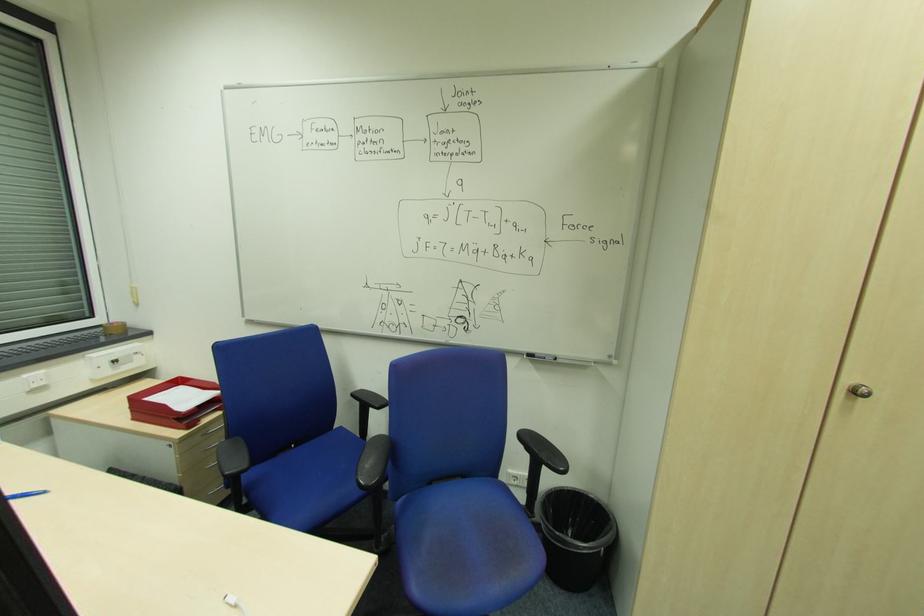
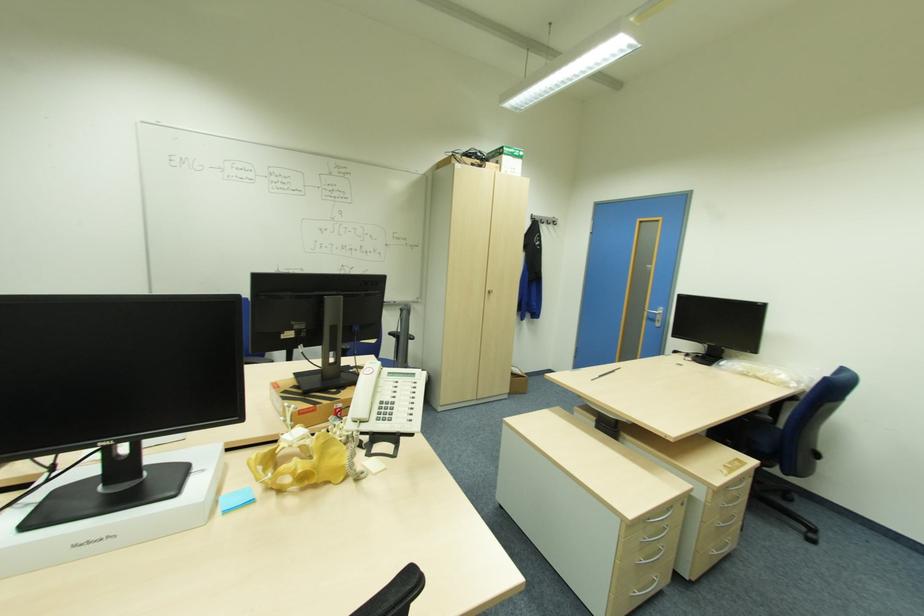
Question: I am providing you with two images of the same scene from different viewpoints. Please identify which objects are invisible in image2.

Choices:
 (A) white cardboard box
 (B) black trash can
 (C) white telephone handset
 (D) bike saddle

Answer: (B)